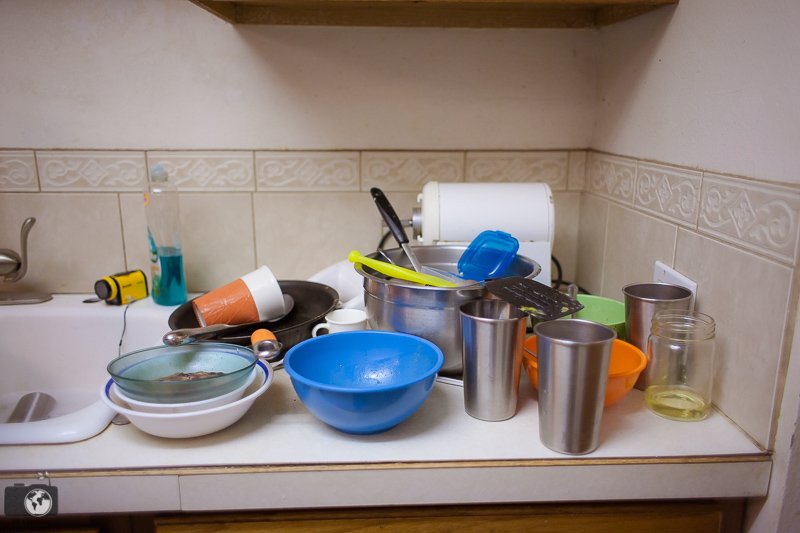
The image size is (800, 533). Find the location of `sink`. sink is located at coordinates (78, 326).